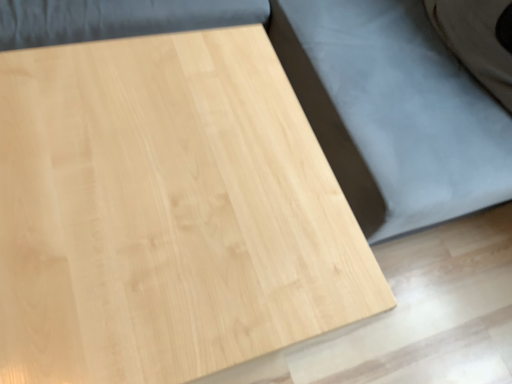
Question: Could you tell me if natural wood bed frame at center is turned towards light wood table at center?

Choices:
 (A) no
 (B) yes

Answer: (B)

Question: Does natural wood bed frame at center have a greater height compared to light wood table at center?

Choices:
 (A) yes
 (B) no

Answer: (A)

Question: Considering the relative sizes of natural wood bed frame at center and light wood table at center in the image provided, is natural wood bed frame at center bigger than light wood table at center?

Choices:
 (A) no
 (B) yes

Answer: (B)

Question: From a real-world perspective, is natural wood bed frame at center on top of light wood table at center?

Choices:
 (A) yes
 (B) no

Answer: (A)

Question: Considering the relative sizes of natural wood bed frame at center and light wood table at center in the image provided, is natural wood bed frame at center wider than light wood table at center?

Choices:
 (A) yes
 (B) no

Answer: (A)

Question: From the image's perspective, is natural wood bed frame at center below light wood table at center?

Choices:
 (A) yes
 (B) no

Answer: (B)

Question: Can you confirm if light wood table at center is positioned to the left of natural wood bed frame at center?

Choices:
 (A) no
 (B) yes

Answer: (B)

Question: From a real-world perspective, is light wood table at center positioned over natural wood bed frame at center based on gravity?

Choices:
 (A) no
 (B) yes

Answer: (A)

Question: Does light wood table at center appear on the right side of natural wood bed frame at center?

Choices:
 (A) yes
 (B) no

Answer: (B)

Question: Is light wood table at center thinner than natural wood bed frame at center?

Choices:
 (A) yes
 (B) no

Answer: (A)

Question: Is light wood table at center next to natural wood bed frame at center?

Choices:
 (A) no
 (B) yes

Answer: (A)

Question: Is light wood table at center positioned beyond the bounds of natural wood bed frame at center?

Choices:
 (A) yes
 (B) no

Answer: (A)

Question: Is point (108, 135) positioned closer to the camera than point (373, 216)?

Choices:
 (A) farther
 (B) closer

Answer: (B)